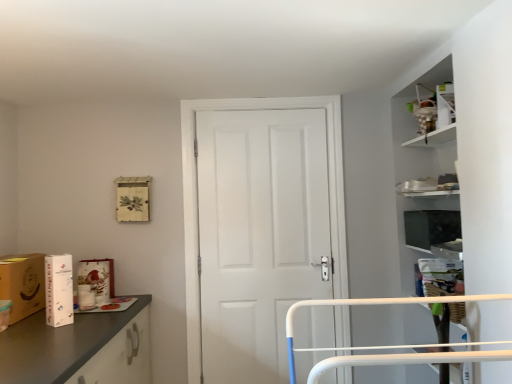
This screenshot has height=384, width=512. What do you see at coordinates (98, 278) in the screenshot?
I see `white cardboard box at left` at bounding box center [98, 278].

In order to face white matte door at center, should I rotate leftwards or rightwards?

Turn right by 1.101 degrees to look at white matte door at center.

This screenshot has height=384, width=512. In order to click on white cardboard box at left in this screenshot , I will do `click(98, 278)`.

From the image's perspective, is white matte cardboard box at left, the first cardboard box positioned from the right, located above matte brown cardboard box at left, which is the first cardboard box from left to right?

Correct, white matte cardboard box at left, the first cardboard box positioned from the right, appears higher than matte brown cardboard box at left, which is the first cardboard box from left to right, in the image.

Is white matte cardboard box at left, the first cardboard box positioned from the right, situated inside matte brown cardboard box at left, arranged as the second cardboard box when viewed from the right, or outside?

white matte cardboard box at left, the first cardboard box positioned from the right, is located beyond the bounds of matte brown cardboard box at left, arranged as the second cardboard box when viewed from the right.

Does point (55, 316) appear closer or farther from the camera than point (35, 302)?

Point (55, 316) is positioned closer to the camera compared to point (35, 302).

Measure the distance from white matte cardboard box at left, which ranks as the second cardboard box in left-to-right order, to matte brown cardboard box at left, which is the first cardboard box from left to right.

19.38 centimeters.

Consider the image. Which is closer to the camera, [6,261] or [84,268]?

The point [6,261] is closer.

Considering the relative sizes of matte brown cardboard box at left, arranged as the second cardboard box when viewed from the right, and white cardboard box at left in the image provided, is matte brown cardboard box at left, arranged as the second cardboard box when viewed from the right, smaller than white cardboard box at left?

Actually, matte brown cardboard box at left, arranged as the second cardboard box when viewed from the right, might be larger than white cardboard box at left.

Consider the image. Is matte brown cardboard box at left, arranged as the second cardboard box when viewed from the right, taller or shorter than white cardboard box at left?

Clearly, matte brown cardboard box at left, arranged as the second cardboard box when viewed from the right, is taller compared to white cardboard box at left.

Considering the relative sizes of white matte door at center and white cardboard box at left in the image provided, is white matte door at center smaller than white cardboard box at left?

No, white matte door at center is not smaller than white cardboard box at left.

Could you tell me if white matte door at center is turned towards white cardboard box at left?

No, white matte door at center does not turn towards white cardboard box at left.

From a real-world perspective, relative to white cardboard box at left, is white matte door at center vertically above or below?

white matte door at center is situated higher than white cardboard box at left in the real world.

Looking at this image, how many degrees apart are the facing directions of white matte door at center and white cardboard box at left?

The angle between the facing direction of white matte door at center and the facing direction of white cardboard box at left is 1.54 degrees.

Is matte brown cardboard box at left, which is the first cardboard box from left to right, facing away from white matte cardboard box at left, the first cardboard box positioned from the right?

matte brown cardboard box at left, which is the first cardboard box from left to right, does not have its back to white matte cardboard box at left, the first cardboard box positioned from the right.

Considering the relative sizes of matte brown cardboard box at left, arranged as the second cardboard box when viewed from the right, and white matte cardboard box at left, which ranks as the second cardboard box in left-to-right order, in the image provided, is matte brown cardboard box at left, arranged as the second cardboard box when viewed from the right, thinner than white matte cardboard box at left, which ranks as the second cardboard box in left-to-right order,?

In fact, matte brown cardboard box at left, arranged as the second cardboard box when viewed from the right, might be wider than white matte cardboard box at left, which ranks as the second cardboard box in left-to-right order.

How far apart are matte brown cardboard box at left, which is the first cardboard box from left to right, and white matte cardboard box at left, the first cardboard box positioned from the right?

A distance of 7.63 inches exists between matte brown cardboard box at left, which is the first cardboard box from left to right, and white matte cardboard box at left, the first cardboard box positioned from the right.

Is matte brown cardboard box at left, arranged as the second cardboard box when viewed from the right, at the left side of white matte cardboard box at left, the first cardboard box positioned from the right?

Yes.

Is white cardboard box at left aimed at matte brown cardboard box at left, arranged as the second cardboard box when viewed from the right?

No, white cardboard box at left is not aimed at matte brown cardboard box at left, arranged as the second cardboard box when viewed from the right.

Based on the photo, does white cardboard box at left have a greater width compared to matte brown cardboard box at left, arranged as the second cardboard box when viewed from the right?

No, white cardboard box at left is not wider than matte brown cardboard box at left, arranged as the second cardboard box when viewed from the right.

Is point (102, 295) closer or farther from the camera than point (1, 270)?

Point (102, 295) is positioned farther from the camera compared to point (1, 270).

Are white matte cardboard box at left, which ranks as the second cardboard box in left-to-right order, and white matte door at center located far from each other?

No, white matte cardboard box at left, which ranks as the second cardboard box in left-to-right order, is not far from white matte door at center.

Would you say white matte cardboard box at left, which ranks as the second cardboard box in left-to-right order, is inside or outside white matte door at center?

white matte cardboard box at left, which ranks as the second cardboard box in left-to-right order, lies outside white matte door at center.

In terms of size, does white matte cardboard box at left, which ranks as the second cardboard box in left-to-right order, appear bigger or smaller than white matte door at center?

Clearly, white matte cardboard box at left, which ranks as the second cardboard box in left-to-right order, is smaller in size than white matte door at center.

Does point (56, 257) lie behind point (196, 381)?

No, (56, 257) is closer to viewer.

From the image's perspective, would you say white cardboard box at left is shown under white matte cardboard box at left, the first cardboard box positioned from the right?

Indeed, from the image's perspective, white cardboard box at left is shown beneath white matte cardboard box at left, the first cardboard box positioned from the right.

Considering the positions of points (99, 275) and (45, 299), is point (99, 275) closer to camera compared to point (45, 299)?

No.

How distant is white cardboard box at left from white matte cardboard box at left, which ranks as the second cardboard box in left-to-right order?

They are 16.81 inches apart.

From a real-world perspective, is white cardboard box at left over white matte cardboard box at left, the first cardboard box positioned from the right?

No, from a real-world perspective, white cardboard box at left is not over white matte cardboard box at left, the first cardboard box positioned from the right

Find the location of a particular element. cardboard box lying below the white matte cardboard box at left, which ranks as the second cardboard box in left-to-right order (from the image's perspective) is located at coordinates (23, 284).

Where is `box directly beneath the matte brown cardboard box at left, arranged as the second cardboard box when viewed from the right (from a real-world perspective)`? The height and width of the screenshot is (384, 512). box directly beneath the matte brown cardboard box at left, arranged as the second cardboard box when viewed from the right (from a real-world perspective) is located at coordinates (98, 278).

Based on the photo, when comparing their distances from white cardboard box at left, does matte brown cardboard box at left, which is the first cardboard box from left to right, or white matte cardboard box at left, the first cardboard box positioned from the right, seem further?

white matte cardboard box at left, the first cardboard box positioned from the right, is further to white cardboard box at left.

Which object lies further to the anchor point white matte door at center, matte brown cardboard box at left, arranged as the second cardboard box when viewed from the right, or white cardboard box at left?

matte brown cardboard box at left, arranged as the second cardboard box when viewed from the right, lies further to white matte door at center than the other object.

When comparing their distances from white cardboard box at left, does white matte door at center or matte brown cardboard box at left, arranged as the second cardboard box when viewed from the right, seem closer?

Based on the image, matte brown cardboard box at left, arranged as the second cardboard box when viewed from the right, appears to be nearer to white cardboard box at left.

When comparing their distances from white matte door at center, does white cardboard box at left or matte brown cardboard box at left, arranged as the second cardboard box when viewed from the right, seem closer?

white cardboard box at left lies closer to white matte door at center than the other object.

When comparing their distances from white matte cardboard box at left, which ranks as the second cardboard box in left-to-right order, does matte brown cardboard box at left, arranged as the second cardboard box when viewed from the right, or white cardboard box at left seem further?

white cardboard box at left is further to white matte cardboard box at left, which ranks as the second cardboard box in left-to-right order.

When comparing their distances from white cardboard box at left, does matte brown cardboard box at left, which is the first cardboard box from left to right, or white matte door at center seem further?

white matte door at center is positioned further to the anchor white cardboard box at left.

Considering their positions, is white matte door at center positioned further to white cardboard box at left than white matte cardboard box at left, which ranks as the second cardboard box in left-to-right order?

The object further to white cardboard box at left is white matte door at center.

From the image, which object appears to be farther from matte brown cardboard box at left, arranged as the second cardboard box when viewed from the right, white matte cardboard box at left, the first cardboard box positioned from the right, or white matte door at center?

white matte door at center is further to matte brown cardboard box at left, arranged as the second cardboard box when viewed from the right.

Locate an element on the screen. The width and height of the screenshot is (512, 384). cardboard box situated between matte brown cardboard box at left, which is the first cardboard box from left to right, and white matte door at center from left to right is located at coordinates (59, 290).

Locate an element on the screen. The height and width of the screenshot is (384, 512). cardboard box situated between white cardboard box at left and white matte door at center from left to right is located at coordinates (59, 290).

Locate an element on the screen. Image resolution: width=512 pixels, height=384 pixels. box situated between matte brown cardboard box at left, arranged as the second cardboard box when viewed from the right, and white matte door at center from left to right is located at coordinates (98, 278).

Image resolution: width=512 pixels, height=384 pixels. I want to click on cardboard box between white matte cardboard box at left, the first cardboard box positioned from the right, and white cardboard box at left from front to back, so click(23, 284).